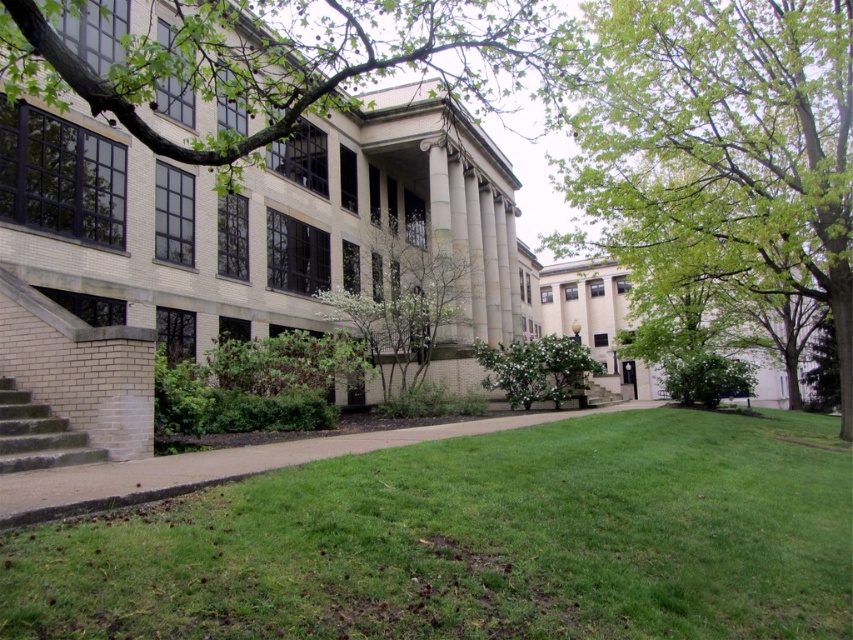
Question: Can you confirm if green leafy branch at upper left is positioned to the right of green leafy tree at center?

Choices:
 (A) yes
 (B) no

Answer: (A)

Question: Is green grass at lower center smaller than green leafy tree at center?

Choices:
 (A) yes
 (B) no

Answer: (A)

Question: Which object is farther from the camera taking this photo?

Choices:
 (A) green leafy bush at center
 (B) green leafy tree at upper right
 (C) brick stairs at lower left

Answer: (A)

Question: Which point is farther to the camera?

Choices:
 (A) green leafy tree at upper right
 (B) green grass at lower center
 (C) green leafy branch at upper left
 (D) brick stairs at lower left

Answer: (A)

Question: Estimate the real-world distances between objects in this image. Which object is closer to the green leafy tree at center?

Choices:
 (A) green leafy tree at upper right
 (B) green grass at lower center
 (C) green leafy branch at upper left
 (D) brick stairs at lower left

Answer: (A)

Question: Is green leafy branch at upper left wider than green leafy tree at center?

Choices:
 (A) no
 (B) yes

Answer: (B)